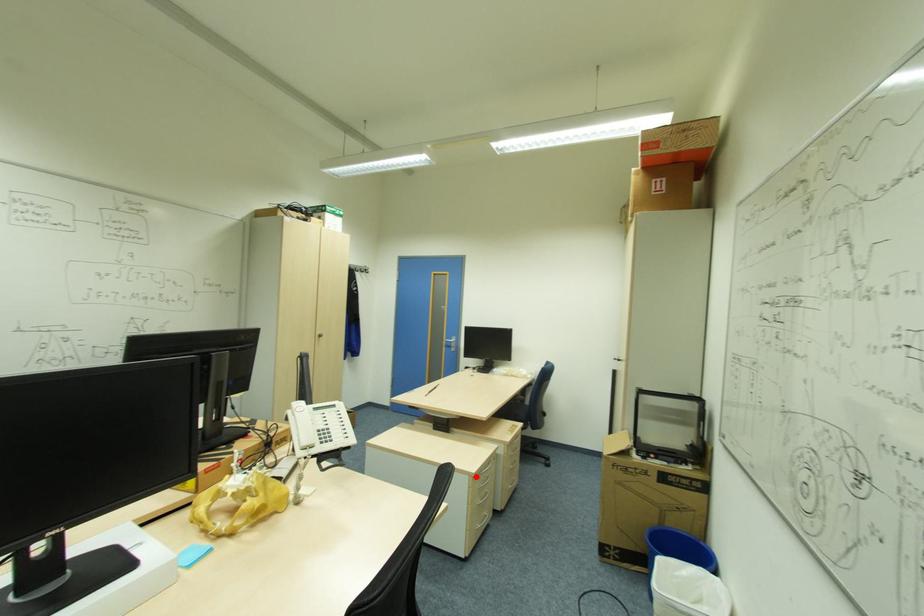
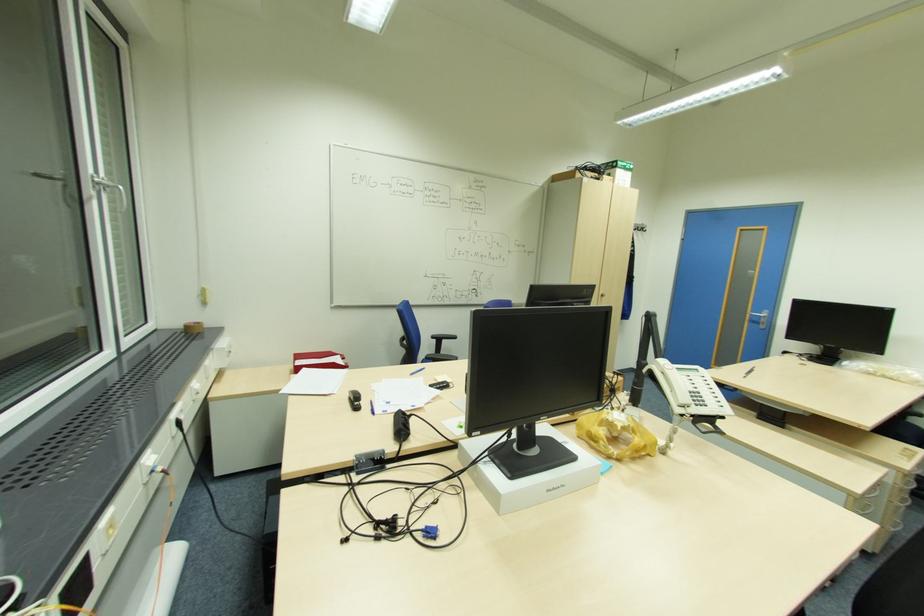
In the second image, find the point that corresponds to the highlighted location in the first image.

(857, 498)